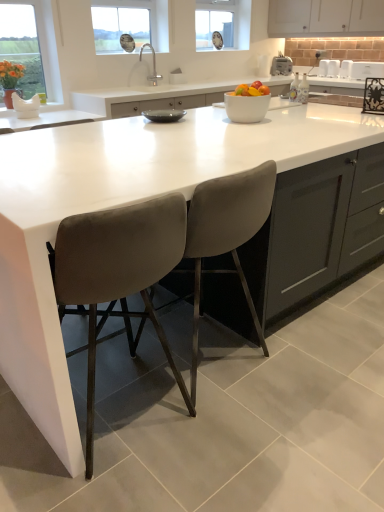
Question: Is point (152, 81) positioned closer to the camera than point (206, 3)?

Choices:
 (A) closer
 (B) farther

Answer: (A)

Question: Is chrome metallic faucet at upper center in front of or behind clear glass clock at upper center, which is the 2th window screen in front-to-back order, in the image?

Choices:
 (A) front
 (B) behind

Answer: (A)

Question: Which of these objects is positioned closest to the clear glass window at upper center?

Choices:
 (A) white matte cabinet at upper center
 (B) matte glass window at upper left, which is the second window screen in back-to-front order
 (C) chrome metallic faucet at upper center
 (D) white plastic toaster at upper right, which appears as the second appliance when viewed from the left
 (E) white glossy microwave at upper right, the 1th appliance from the right

Answer: (C)

Question: Which object is the farthest from the white glossy microwave at upper right, arranged as the 1th appliance when viewed from the front?

Choices:
 (A) matte glass window at upper left, which is the second window screen in back-to-front order
 (B) white plastic toaster at upper right, acting as the 2th appliance starting from the right
 (C) clear glass window at upper center
 (D) chrome metallic faucet at upper center
 (E) white plastic toaster at upper center, arranged as the 1th appliance when viewed from the left

Answer: (A)